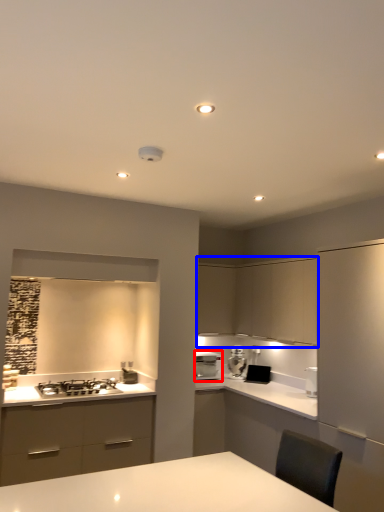
Question: Which of the following is the closest to the observer, home appliance (highlighted by a red box) or cabinetry (highlighted by a blue box)?

Choices:
 (A) home appliance
 (B) cabinetry

Answer: (B)